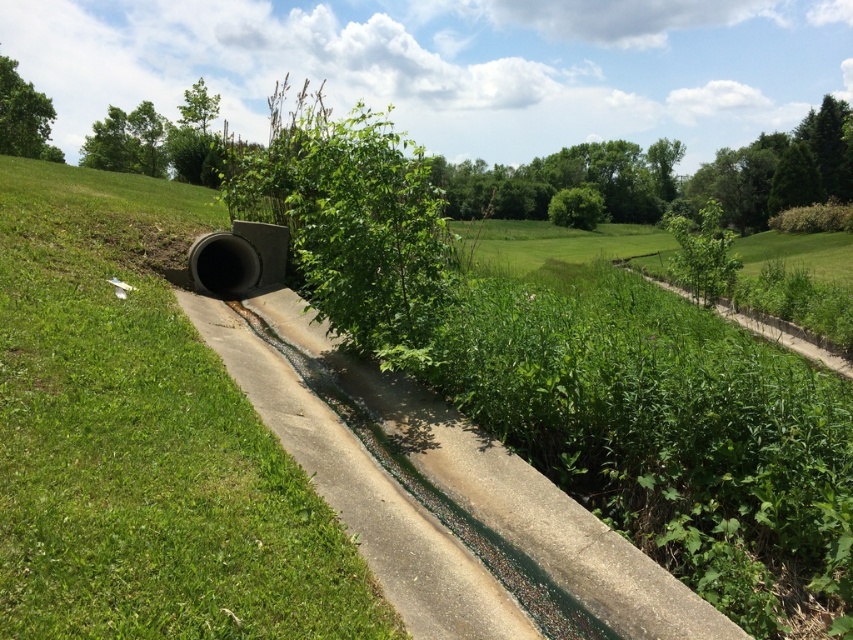
Question: Which point is closer to the camera?

Choices:
 (A) green grass at center
 (B) green leafy plant at upper right

Answer: (A)

Question: Considering the relative positions of green grass at center and green leafy plant at upper right in the image provided, where is green grass at center located with respect to green leafy plant at upper right?

Choices:
 (A) left
 (B) right

Answer: (A)

Question: Which object is the farthest from the green leafy plant at center?

Choices:
 (A) green grass at center
 (B) green leafy plant at upper right

Answer: (B)

Question: Which is nearer to the green leafy plant at center?

Choices:
 (A) green leafy plant at upper right
 (B) green grass at center

Answer: (B)

Question: Does green leafy plant at center appear over green leafy plant at upper right?

Choices:
 (A) yes
 (B) no

Answer: (A)

Question: Is green grass at center in front of green leafy plant at center?

Choices:
 (A) no
 (B) yes

Answer: (B)